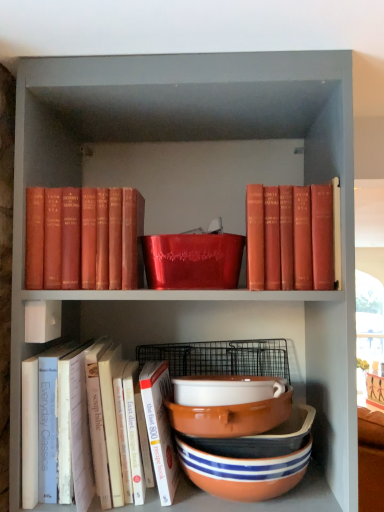
In the scene shown: Measure the distance between point (246, 221) and camera.

Point (246, 221) and camera are 81.30 centimeters apart.

Describe the element at coordinates (84, 239) in the screenshot. I see `matte red book at upper left, the second book from the bottom` at that location.

In the scene shown: What is the approximate width of white paper book at lower left, acting as the 1th book starting from the bottom?

white paper book at lower left, acting as the 1th book starting from the bottom, is 32.79 centimeters in width.

This screenshot has height=512, width=384. What do you see at coordinates (243, 472) in the screenshot?
I see `terracotta ceramic bowl at lower center, the 3th bowl in the top-to-bottom sequence` at bounding box center [243, 472].

The width and height of the screenshot is (384, 512). In order to click on matte red book at upper right, acting as the third book starting from the bottom in this screenshot , I will do `click(290, 237)`.

Is there a large distance between white paper book at lower left, which ranks as the second book in left-to-right order, and terracotta ceramic bowl at lower center, arranged as the 1th bowl when ordered from the bottom?

No, there isn't a large distance between white paper book at lower left, which ranks as the second book in left-to-right order, and terracotta ceramic bowl at lower center, arranged as the 1th bowl when ordered from the bottom.

Is point (24, 441) more distant than point (255, 499)?

No, it is not.

Is white paper book at lower left, which ranks as the second book in left-to-right order, inside or outside of terracotta ceramic bowl at lower center, arranged as the 1th bowl when ordered from the bottom?

white paper book at lower left, which ranks as the second book in left-to-right order, is outside terracotta ceramic bowl at lower center, arranged as the 1th bowl when ordered from the bottom.

You are a GUI agent. You are given a task and a screenshot of the screen. Output one action in this format:
    pyautogui.click(x=<x>, y=<y>)
    Task: Click on the book in front of the terracotta ceramic bowl at lower center, the 3th bowl in the top-to-bottom sequence
    The image size is (384, 512).
    Given the screenshot: What is the action you would take?
    pyautogui.click(x=66, y=424)

Can matte red book at upper right, the first book viewed from the top, be found inside striped ceramic bowls at lower center, which is the second bowl from bottom to top?

Definitely not — matte red book at upper right, the first book viewed from the top, is not inside striped ceramic bowls at lower center, which is the second bowl from bottom to top.

Considering their positions, is striped ceramic bowls at lower center, which is the second bowl from bottom to top, located in front of or behind matte red book at upper right, the first book viewed from the top?

Clearly, striped ceramic bowls at lower center, which is the second bowl from bottom to top, is behind matte red book at upper right, the first book viewed from the top.

Between striped ceramic bowls at lower center, which is the second bowl from bottom to top, and matte red book at upper right, acting as the third book starting from the bottom, which one has smaller size?

Smaller between the two is striped ceramic bowls at lower center, which is the second bowl from bottom to top.

Is white ceramic bowl at center, which is counted as the 1th bowl, starting from the top, spatially inside matte red book at upper left, arranged as the second book when viewed from the top, or outside of it?

white ceramic bowl at center, which is counted as the 1th bowl, starting from the top, cannot be found inside matte red book at upper left, arranged as the second book when viewed from the top.

From the image's perspective, which one is positioned higher, white ceramic bowl at center, the third bowl positioned from the bottom, or matte red book at upper left, the 3th book from the right?

matte red book at upper left, the 3th book from the right, appears higher in the image.

How much distance is there between white ceramic bowl at center, which is counted as the 1th bowl, starting from the top, and matte red book at upper left, the second book from the bottom?

A distance of 13.37 inches exists between white ceramic bowl at center, which is counted as the 1th bowl, starting from the top, and matte red book at upper left, the second book from the bottom.

Which book is the 2nd one when counting from the left side of the white ceramic bowl at center, which is counted as the 1th bowl, starting from the top? Please provide its 2D coordinates.

[(84, 239)]

Which is in front, matte red book at upper right, acting as the third book starting from the bottom, or matte red book at upper left, positioned as the 1th book in left-to-right order?

matte red book at upper right, acting as the third book starting from the bottom.

Looking at this image, from a real-world perspective, is matte red book at upper right, acting as the third book starting from the bottom, on matte red book at upper left, the 3th book from the right?

Indeed, from a real-world perspective, matte red book at upper right, acting as the third book starting from the bottom, stands above matte red book at upper left, the 3th book from the right.

Is striped ceramic bowls at lower center, which is the second bowl from bottom to top, not close to matte red book at upper left, the second book from the bottom?

They are positioned close to each other.

Can you confirm if striped ceramic bowls at lower center, which is the second bowl from bottom to top, is positioned to the right of matte red book at upper left, arranged as the second book when viewed from the top?

Correct, you'll find striped ceramic bowls at lower center, which is the second bowl from bottom to top, to the right of matte red book at upper left, arranged as the second book when viewed from the top.

Based on the photo, would you say striped ceramic bowls at lower center, which appears as the second bowl when viewed from the top, is inside or outside matte red book at upper left, arranged as the second book when viewed from the top?

striped ceramic bowls at lower center, which appears as the second bowl when viewed from the top, exists outside the volume of matte red book at upper left, arranged as the second book when viewed from the top.

Based on the photo, how distant is striped ceramic bowls at lower center, which appears as the second bowl when viewed from the top, from matte red book at upper left, the 3th book from the right?

A distance of 43.23 centimeters exists between striped ceramic bowls at lower center, which appears as the second bowl when viewed from the top, and matte red book at upper left, the 3th book from the right.

From a real-world perspective, does white ceramic bowl at center, the third bowl positioned from the bottom, stand above terracotta ceramic bowl at lower center, arranged as the 1th bowl when ordered from the bottom?

Correct, in the physical world, white ceramic bowl at center, the third bowl positioned from the bottom, is higher than terracotta ceramic bowl at lower center, arranged as the 1th bowl when ordered from the bottom.

Which of these two, white ceramic bowl at center, which is counted as the 1th bowl, starting from the top, or terracotta ceramic bowl at lower center, the 3th bowl in the top-to-bottom sequence, is smaller?

With smaller size is white ceramic bowl at center, which is counted as the 1th bowl, starting from the top.

Is white ceramic bowl at center, the third bowl positioned from the bottom, turned away from terracotta ceramic bowl at lower center, the 3th bowl in the top-to-bottom sequence?

No, white ceramic bowl at center, the third bowl positioned from the bottom, is not facing away from terracotta ceramic bowl at lower center, the 3th bowl in the top-to-bottom sequence.

Is white ceramic bowl at center, the third bowl positioned from the bottom, inside or outside of terracotta ceramic bowl at lower center, arranged as the 1th bowl when ordered from the bottom?

white ceramic bowl at center, the third bowl positioned from the bottom, is not enclosed by terracotta ceramic bowl at lower center, arranged as the 1th bowl when ordered from the bottom.

Is terracotta ceramic bowl at lower center, the 3th bowl in the top-to-bottom sequence, oriented away from matte red book at upper left, the second book from the bottom?

terracotta ceramic bowl at lower center, the 3th bowl in the top-to-bottom sequence, is not turned away from matte red book at upper left, the second book from the bottom.

Does point (183, 465) lie in front of point (105, 283)?

No.

Does terracotta ceramic bowl at lower center, arranged as the 1th bowl when ordered from the bottom, appear on the right side of matte red book at upper left, arranged as the second book when viewed from the top?

Yes, terracotta ceramic bowl at lower center, arranged as the 1th bowl when ordered from the bottom, is to the right of matte red book at upper left, arranged as the second book when viewed from the top.

At what (x,y) coordinates should I click in order to perform the action: click on the 1st book above the terracotta ceramic bowl at lower center, the 3th bowl in the top-to-bottom sequence (from a real-world perspective). Please return your answer as a coordinate pair (x, y). The width and height of the screenshot is (384, 512). Looking at the image, I should click on (66, 424).

Locate an element on the screen. This screenshot has height=512, width=384. the 2nd book in front when counting from the striped ceramic bowls at lower center, which appears as the second bowl when viewed from the top is located at coordinates (290, 237).

Looking at the image, which one is located further to striped ceramic bowls at lower center, which is the second bowl from bottom to top, matte red book at upper right, which ranks as the third book in left-to-right order, or white ceramic bowl at center, the third bowl positioned from the bottom?

Among the two, matte red book at upper right, which ranks as the third book in left-to-right order, is located further to striped ceramic bowls at lower center, which is the second bowl from bottom to top.

Considering their positions, is striped ceramic bowls at lower center, which appears as the second bowl when viewed from the top, positioned further to matte red book at upper left, the 3th book from the right, than white ceramic bowl at center, the third bowl positioned from the bottom?

striped ceramic bowls at lower center, which appears as the second bowl when viewed from the top.

Estimate the real-world distances between objects in this image. Which object is closer to matte red book at upper left, the 3th book from the right, striped ceramic bowls at lower center, which is the second bowl from bottom to top, or white paper book at lower left, which ranks as the second book in left-to-right order?

Among the two, white paper book at lower left, which ranks as the second book in left-to-right order, is located nearer to matte red book at upper left, the 3th book from the right.

From the image, which object appears to be nearer to striped ceramic bowls at lower center, which is the second bowl from bottom to top, matte red book at upper left, the second book from the bottom, or white ceramic bowl at center, the third bowl positioned from the bottom?

The object closer to striped ceramic bowls at lower center, which is the second bowl from bottom to top, is white ceramic bowl at center, the third bowl positioned from the bottom.

When comparing their distances from white ceramic bowl at center, the third bowl positioned from the bottom, does striped ceramic bowls at lower center, which appears as the second bowl when viewed from the top, or white paper book at lower left, placed as the 3th book when sorted from top to bottom, seem further?

The object further to white ceramic bowl at center, the third bowl positioned from the bottom, is white paper book at lower left, placed as the 3th book when sorted from top to bottom.

When comparing their distances from white paper book at lower left, acting as the 1th book starting from the bottom, does white ceramic bowl at center, which is counted as the 1th bowl, starting from the top, or striped ceramic bowls at lower center, which appears as the second bowl when viewed from the top, seem further?

striped ceramic bowls at lower center, which appears as the second bowl when viewed from the top, lies further to white paper book at lower left, acting as the 1th book starting from the bottom, than the other object.

Considering their positions, is terracotta ceramic bowl at lower center, the 3th bowl in the top-to-bottom sequence, positioned closer to striped ceramic bowls at lower center, which is the second bowl from bottom to top, than matte red book at upper right, which ranks as the third book in left-to-right order?

terracotta ceramic bowl at lower center, the 3th bowl in the top-to-bottom sequence, is positioned closer to the anchor striped ceramic bowls at lower center, which is the second bowl from bottom to top.

Considering their positions, is matte red book at upper right, the first book viewed from the top, positioned further to terracotta ceramic bowl at lower center, the 3th bowl in the top-to-bottom sequence, than white ceramic bowl at center, which is counted as the 1th bowl, starting from the top?

matte red book at upper right, the first book viewed from the top, lies further to terracotta ceramic bowl at lower center, the 3th bowl in the top-to-bottom sequence, than the other object.

I want to click on bowl between white paper book at lower left, placed as the 3th book when sorted from top to bottom, and striped ceramic bowls at lower center, which is the second bowl from bottom to top, so click(x=225, y=390).

The width and height of the screenshot is (384, 512). In order to click on bowl that lies between matte red book at upper right, which ranks as the third book in left-to-right order, and striped ceramic bowls at lower center, which appears as the second bowl when viewed from the top, from top to bottom in this screenshot , I will do `click(225, 390)`.

This screenshot has width=384, height=512. I want to click on bowl between matte red book at upper left, the second book from the bottom, and striped ceramic bowls at lower center, which appears as the second bowl when viewed from the top, from top to bottom, so click(225, 390).

Locate an element on the screen. This screenshot has height=512, width=384. bowl between matte red book at upper left, the second book from the bottom, and white paper book at lower left, acting as the 1th book starting from the bottom, in the vertical direction is located at coordinates (225, 390).